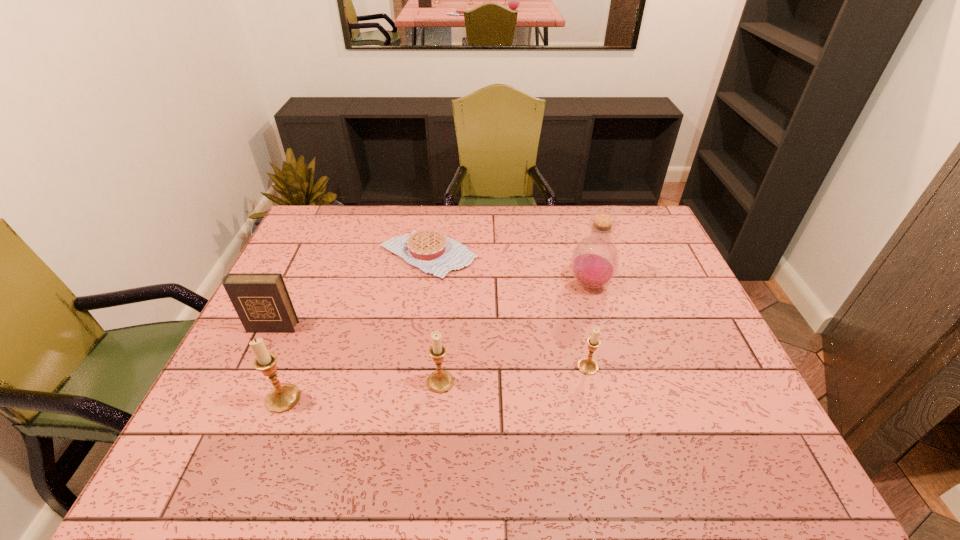
This screenshot has width=960, height=540. What are the coordinates of `free space that satisfies the following two spatial constraints: 1. on the front side of the shortest object; 2. on the right side of the shortest candle holder` in the screenshot? It's located at (412, 367).